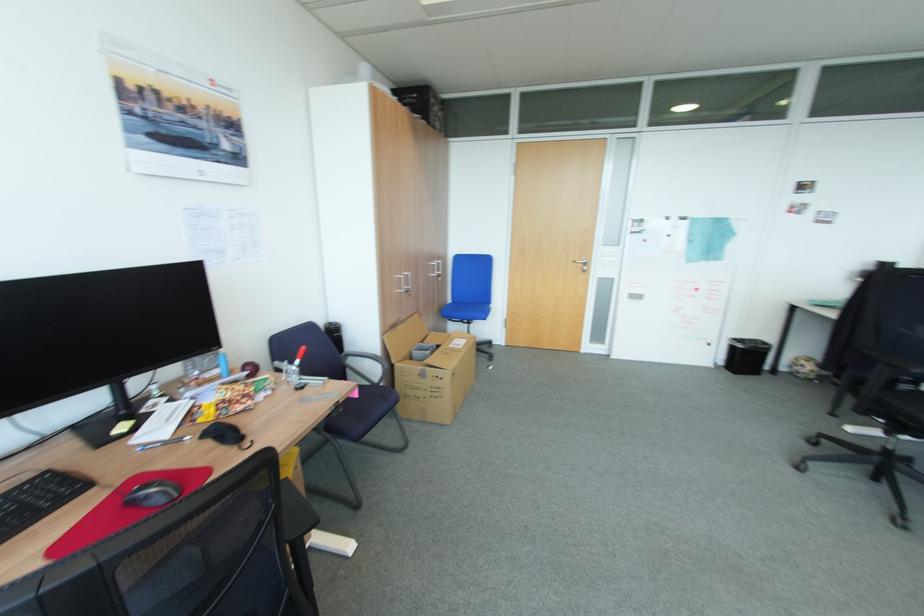
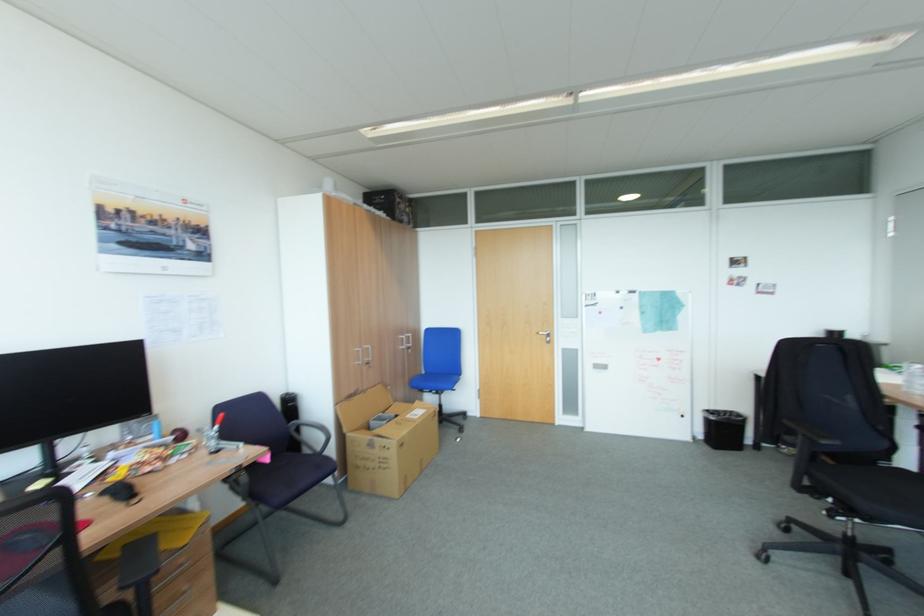
Question: Which direction would the cameraman need to move to produce the second image? Reply with the corresponding letter.

Choices:
 (A) Left
 (B) Right
 (C) Forward
 (D) Backward

Answer: (B)